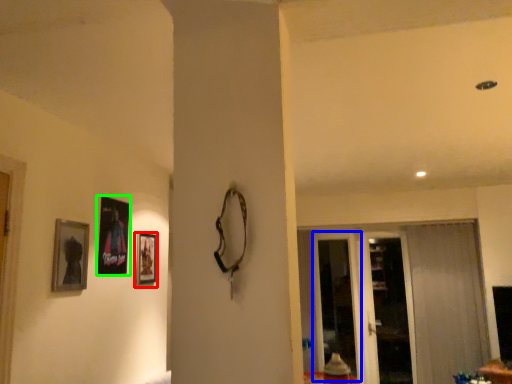
Question: Estimate the real-world distances between objects in this image. Which object is closer to picture frame (highlighted by a red box), screen door (highlighted by a blue box) or picture frame (highlighted by a green box)?

Choices:
 (A) screen door
 (B) picture frame

Answer: (B)